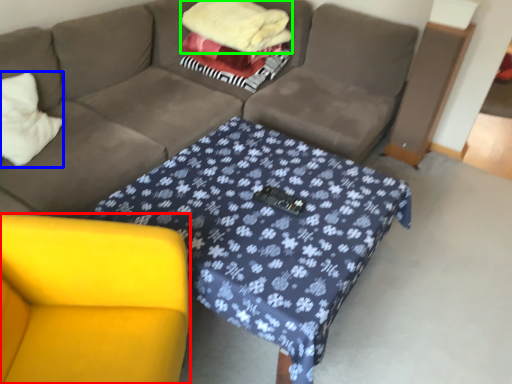
Question: Estimate the real-world distances between objects in this image. Which object is closer to armchair (highlighted by a red box), throw pillow (highlighted by a blue box) or blanket (highlighted by a green box)?

Choices:
 (A) throw pillow
 (B) blanket

Answer: (A)